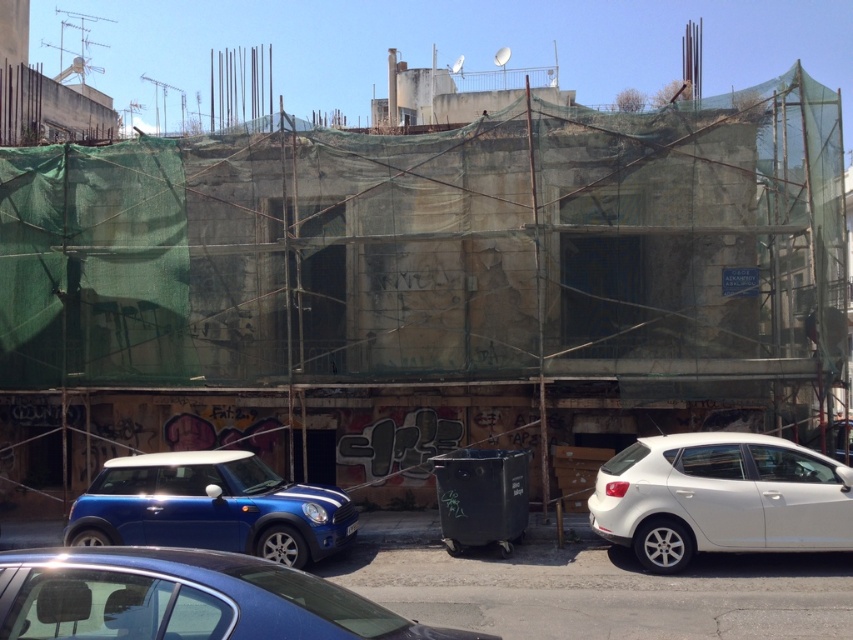
Is point (206, 592) farther from viewer compared to point (764, 529)?

That is False.

Who is higher up, shiny blue sedan at lower center or white matte hatchback at right?

shiny blue sedan at lower center is above.

Find the location of a particular element. The image size is (853, 640). shiny blue sedan at lower center is located at coordinates (184, 598).

Does shiny blue sedan at lower center have a lesser width compared to shiny blue car at lower left?

Correct, shiny blue sedan at lower center's width is less than shiny blue car at lower left's.

Describe the element at coordinates (184, 598) in the screenshot. This screenshot has width=853, height=640. I see `shiny blue sedan at lower center` at that location.

Who is more distant from viewer, [352,605] or [270,522]?

Point [270,522]

Identify the location of shiny blue sedan at lower center. (184, 598).

Between white matte hatchback at right and shiny blue car at lower left, which one has less height?

shiny blue car at lower left

Is white matte hatchback at right smaller than shiny blue car at lower left?

Indeed, white matte hatchback at right has a smaller size compared to shiny blue car at lower left.

The image size is (853, 640). I want to click on white matte hatchback at right, so click(720, 497).